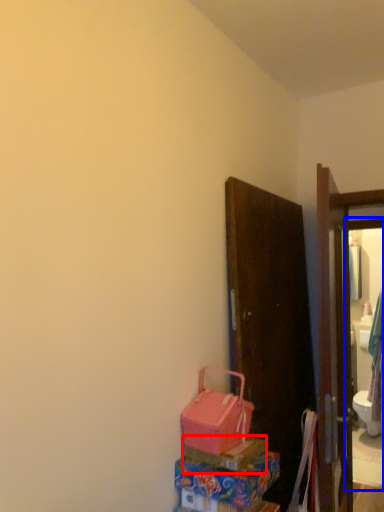
Question: Which of the following is the closest to the observer, box (highlighted by a red box) or mirror (highlighted by a blue box)?

Choices:
 (A) box
 (B) mirror

Answer: (A)